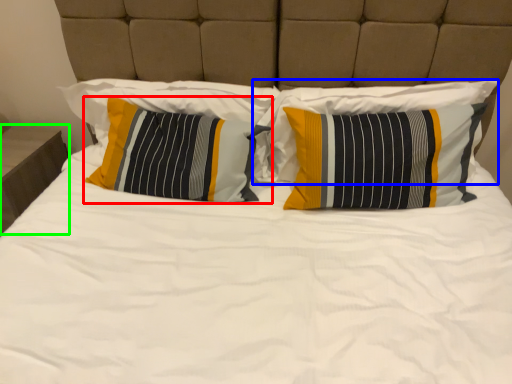
Question: Which is farther away from pillow (highlighted by a red box)? pillow (highlighted by a blue box) or nightstand (highlighted by a green box)?

Choices:
 (A) pillow
 (B) nightstand

Answer: (B)